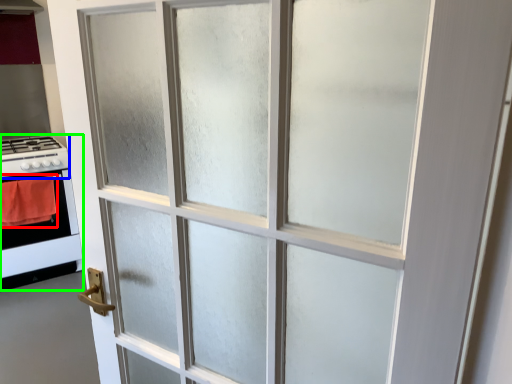
Question: Considering the real-world distances, which object is farthest from blanket (highlighted by a red box)? gas stove (highlighted by a blue box) or appliance (highlighted by a green box)?

Choices:
 (A) gas stove
 (B) appliance

Answer: (A)